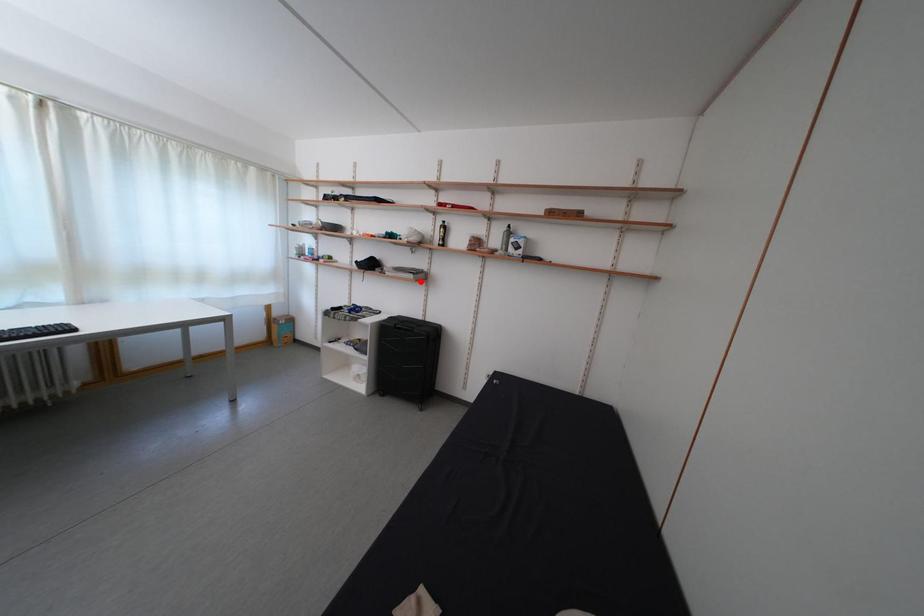
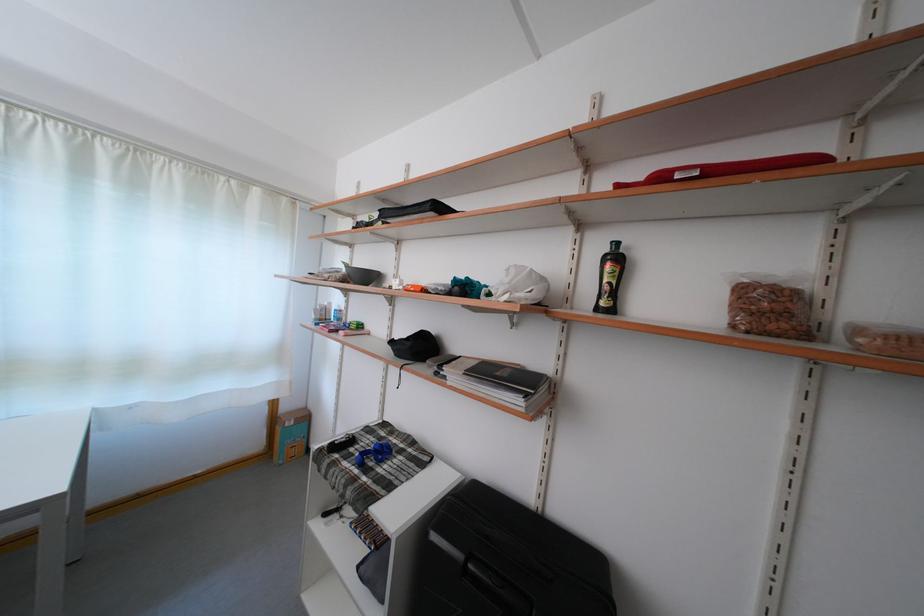
Question: I am providing you with two images of the same scene from different viewpoints. Given a red point in image1, look at the same physical point in image2. Is it:

Choices:
 (A) Closer to the viewpoint
 (B) Farther from the viewpoint

Answer: (B)